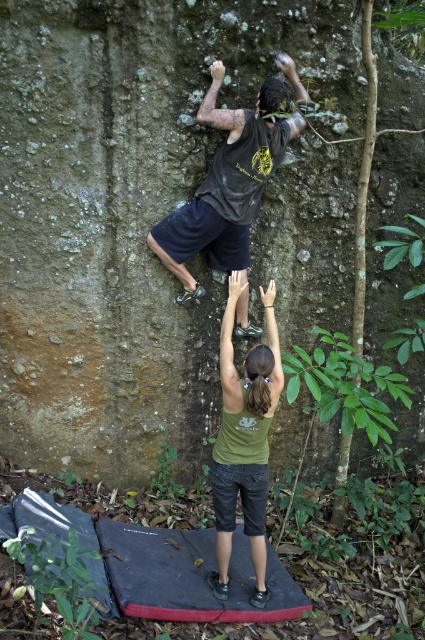
Which of these two, black matte shirt at upper center or green matte shirt at center, stands shorter?

Standing shorter between the two is black matte shirt at upper center.

Who is more forward, (286, 128) or (246, 440)?

Point (246, 440) is in front.

I want to click on black matte shirt at upper center, so click(x=226, y=186).